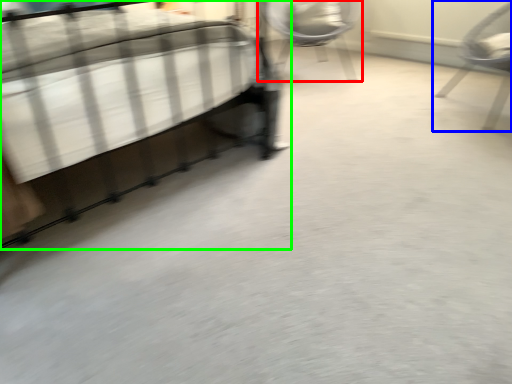
Question: Based on their relative distances, which object is nearer to chair (highlighted by a red box)? Choose from chair (highlighted by a blue box) and bed (highlighted by a green box).

Choices:
 (A) chair
 (B) bed

Answer: (A)